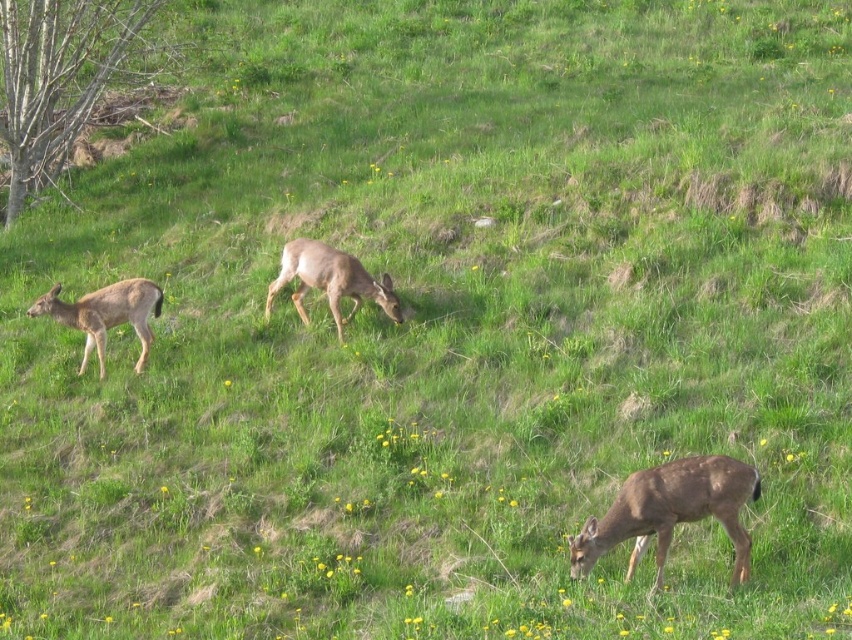
Identify the location of brown matte deer at center. (330, 280).

Can you confirm if brown matte deer at center is thinner than brown fur deer at left?

Incorrect, brown matte deer at center's width is not less than brown fur deer at left's.

Who is more distant from viewer, (283, 250) or (72, 308)?

The point (283, 250) is behind.

What are the coordinates of `brown matte deer at center` in the screenshot? It's located at (330, 280).

Looking at this image, between brown matte deer at lower right and brown fur deer at left, which one has more height?

brown fur deer at left is taller.

The image size is (852, 640). Identify the location of brown matte deer at lower right. (671, 513).

Who is taller, brown matte deer at lower right or brown matte deer at center?

Standing taller between the two is brown matte deer at center.

Does brown matte deer at lower right appear under brown matte deer at center?

Correct, brown matte deer at lower right is located below brown matte deer at center.

Find the location of `brown matte deer at lower right`. brown matte deer at lower right is located at coordinates tap(671, 513).